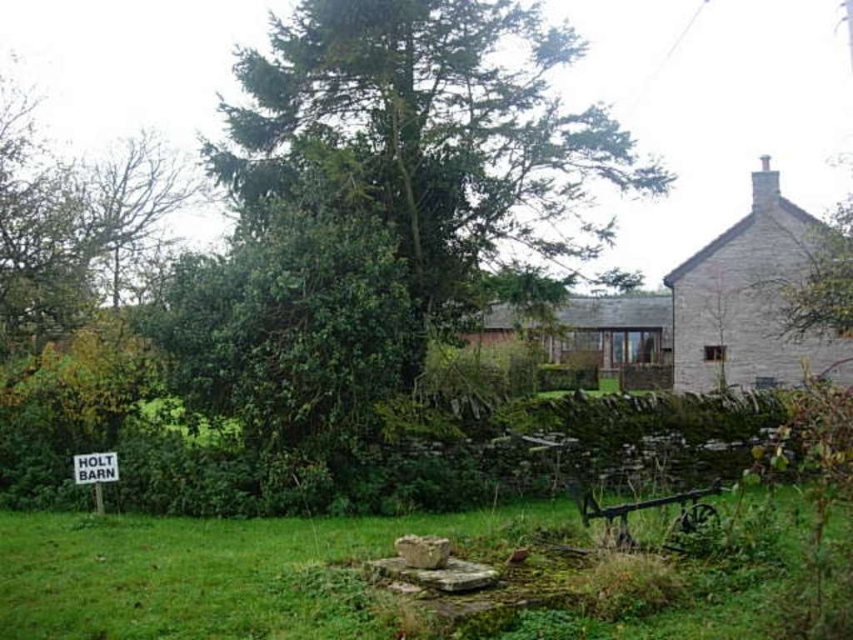
Question: Does green grass at lower center lie in front of stone cottage at upper right?

Choices:
 (A) yes
 (B) no

Answer: (A)

Question: Which object is closer to the camera taking this photo?

Choices:
 (A) brown wooden cottage at center
 (B) stone cottage at upper right

Answer: (A)

Question: Among these points, which one is nearest to the camera?

Choices:
 (A) (485, 342)
 (B) (74, 460)
 (C) (488, 108)
 (D) (154, 520)

Answer: (D)

Question: Is green leafy tree at center smaller than brown wooden cottage at center?

Choices:
 (A) yes
 (B) no

Answer: (A)

Question: Which object appears closest to the camera in this image?

Choices:
 (A) stone cottage at upper right
 (B) white paper sign at lower left
 (C) brown wooden cottage at center

Answer: (B)

Question: Does green leafy tree at center have a larger size compared to brown wooden cottage at center?

Choices:
 (A) no
 (B) yes

Answer: (A)